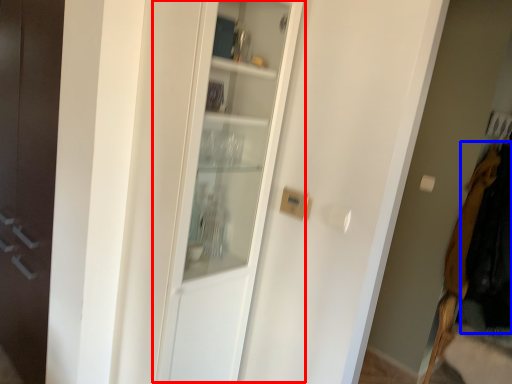
Question: Which object appears farthest to the camera in this image, cabinetry (highlighted by a red box) or clothing (highlighted by a blue box)?

Choices:
 (A) cabinetry
 (B) clothing

Answer: (B)